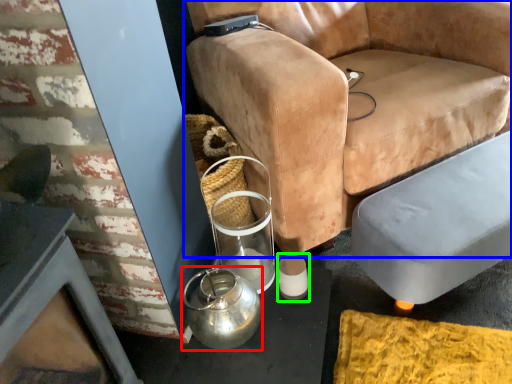
Question: Based on their relative distances, which object is farther from tea pot (highlighted by a red box)? Choose from chair (highlighted by a blue box) and candle holder (highlighted by a green box).

Choices:
 (A) chair
 (B) candle holder

Answer: (A)